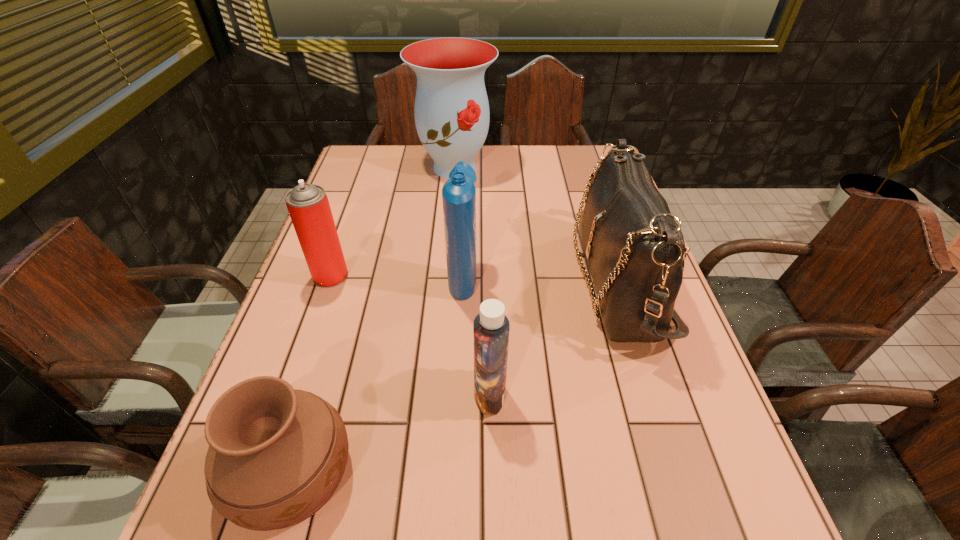
Image resolution: width=960 pixels, height=540 pixels. Find the location of `vacant region at the far left corner of the desktop`. vacant region at the far left corner of the desktop is located at coordinates (379, 161).

Where is `unoccupied area between the aerosol can and the vase`? This screenshot has height=540, width=960. unoccupied area between the aerosol can and the vase is located at coordinates (393, 221).

Image resolution: width=960 pixels, height=540 pixels. What are the coordinates of `free spot between the shorter shampoo and the aerosol can` in the screenshot? It's located at (410, 335).

At what (x,y) coordinates should I click in order to perform the action: click on vacant area that lies between the taller shampoo and the aerosol can. Please return your answer as a coordinate pair (x, y). This screenshot has height=540, width=960. Looking at the image, I should click on (396, 275).

Identify which object is the fifth nearest to the rightmost object. Please provide its 2D coordinates. Your answer should be formatted as a tuple, i.e. [(x, y)], where the tuple contains the x and y coordinates of a point satisfying the conditions above.

[(308, 206)]

Identify which object is the second closest to the rightmost object. Please provide its 2D coordinates. Your answer should be formatted as a tuple, i.e. [(x, y)], where the tuple contains the x and y coordinates of a point satisfying the conditions above.

[(458, 193)]